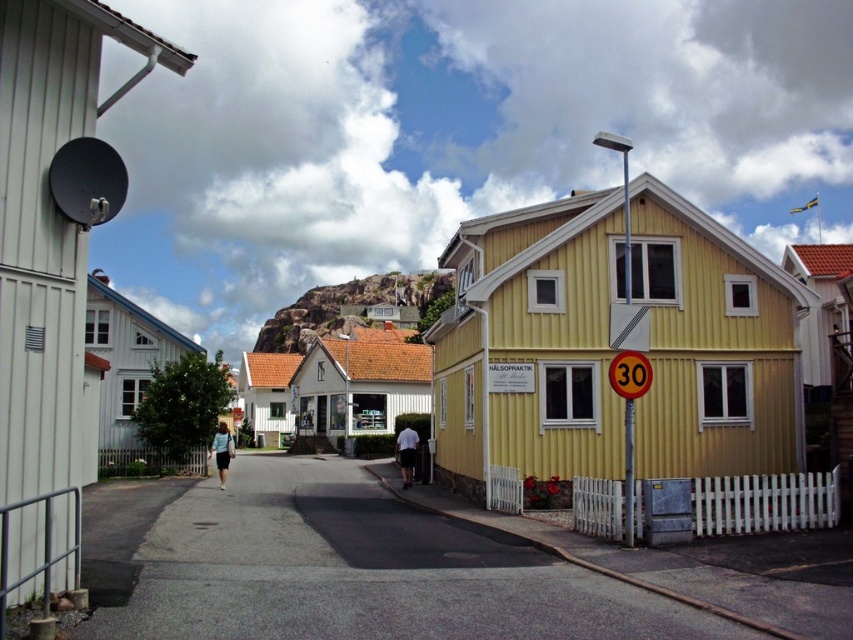
Question: Can you confirm if white cotton shorts at center is bigger than light blue denim jacket at center?

Choices:
 (A) no
 (B) yes

Answer: (A)

Question: Does white cotton shorts at center appear on the right side of light blue denim jacket at center?

Choices:
 (A) yes
 (B) no

Answer: (A)

Question: Which object appears farthest from the camera in this image?

Choices:
 (A) yellow plastic speed limit sign at right
 (B) light blue denim jacket at center
 (C) white cotton shorts at center

Answer: (C)

Question: Based on their relative distances, which object is farther from the white cotton shorts at center?

Choices:
 (A) yellow plastic speed limit sign at right
 (B) light blue denim jacket at center

Answer: (A)

Question: Which is farther from the white cotton shorts at center?

Choices:
 (A) light blue denim jacket at center
 (B) yellow plastic speed limit sign at right

Answer: (B)

Question: Does yellow plastic speed limit sign at right appear on the right side of white cotton shorts at center?

Choices:
 (A) no
 (B) yes

Answer: (B)